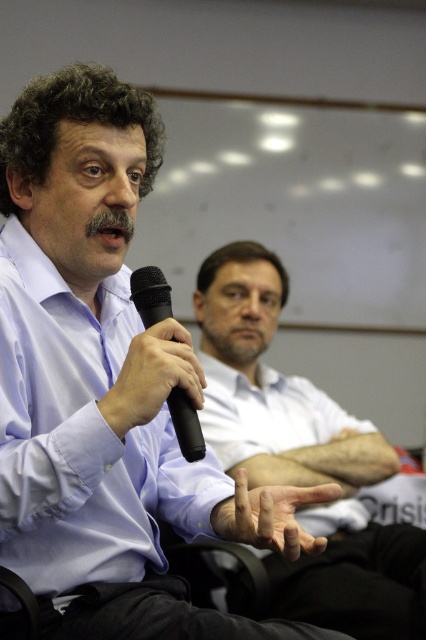
Question: Does white shirt at center come in front of matte black microphone at center?

Choices:
 (A) yes
 (B) no

Answer: (B)

Question: Can you confirm if matte black microphone at center is wider than smooth skin hand at center?

Choices:
 (A) yes
 (B) no

Answer: (B)

Question: Which point is closer to the camera?

Choices:
 (A) black matte microphone at left
 (B) white shirt at center
 (C) matte black microphone at center

Answer: (C)

Question: Which point is farther to the camera?

Choices:
 (A) (175, 403)
 (B) (108, 406)
 (C) (80, 509)
 (D) (294, 545)

Answer: (C)

Question: Is the position of matte black microphone at center less distant than that of black matte microphone at left?

Choices:
 (A) yes
 (B) no

Answer: (A)

Question: Estimate the real-world distances between objects in this image. Which object is farther from the white shirt at center?

Choices:
 (A) matte black microphone at center
 (B) smooth skin hand at center

Answer: (A)